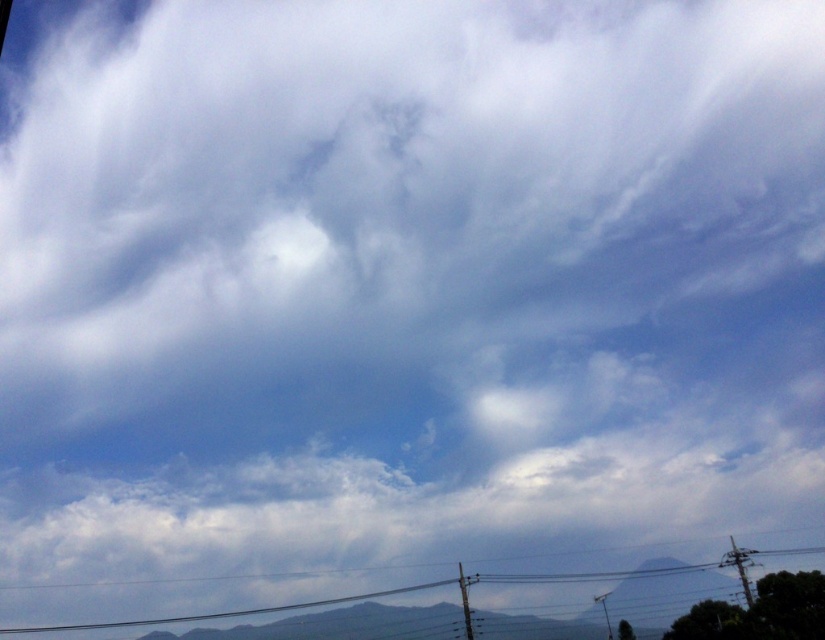
You are a drone operator planning to fly a drone between the black wire at bottom and the metallic gray pole at lower center. The drone has a wingspan of 1.5 meters. Based on the scene, can the drone safely pass through the space between them?

The distance between the black wire at bottom and the metallic gray pole at lower center is 43.85 meters, which is significantly wider than the drone wingspan of 1.5 meters. The drone can safely pass through the space between them.